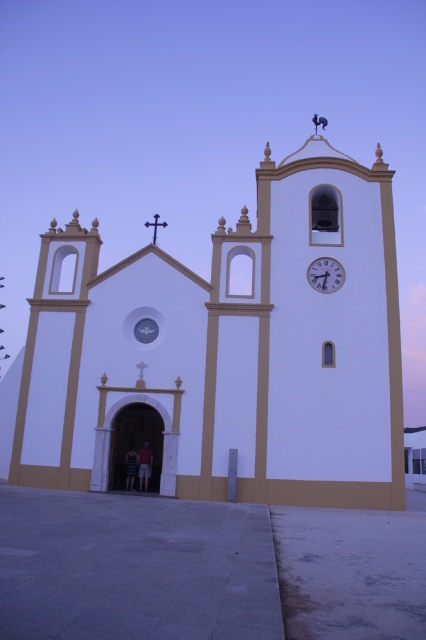
Does white smooth church at center have a greater width compared to dark gray fabric shirt at center?

Yes, white smooth church at center is wider than dark gray fabric shirt at center.

Does point (261, 317) come closer to viewer compared to point (135, 465)?

No, (261, 317) is further to viewer.

Who is more distant from viewer, (282, 500) or (126, 474)?

Point (126, 474)

You are a GUI agent. You are given a task and a screenshot of the screen. Output one action in this format:
    pyautogui.click(x=<x>, y=<y>)
    Task: Click on the white smooth church at center
    Image resolution: width=426 pixels, height=640 pixels.
    Given the screenshot: What is the action you would take?
    pyautogui.click(x=229, y=349)

Is white matte clock at upper right further to camera compared to dark gray fabric shirt at center?

Yes, it is.

This screenshot has height=640, width=426. Describe the element at coordinates (325, 275) in the screenshot. I see `white matte clock at upper right` at that location.

Image resolution: width=426 pixels, height=640 pixels. Describe the element at coordinates (325, 275) in the screenshot. I see `white matte clock at upper right` at that location.

The height and width of the screenshot is (640, 426). I want to click on white matte clock at upper right, so click(325, 275).

Can you confirm if white smooth church at center is wider than white matte clock at upper right?

Yes, white smooth church at center is wider than white matte clock at upper right.

Which is in front, point (259, 388) or point (331, 276)?

Point (259, 388) is more forward.

Locate an element on the screen. This screenshot has width=426, height=640. white smooth church at center is located at coordinates (229, 349).